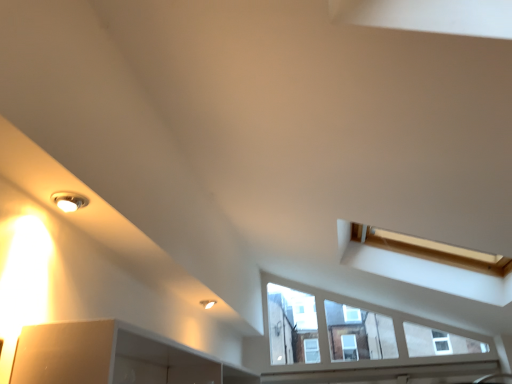
Question: From a real-world perspective, is matte white light fixture at upper left, which ranks as the 1th light fixture in right-to-left order, above or below white painted wood at lower center?

Choices:
 (A) below
 (B) above

Answer: (B)

Question: Is matte white light fixture at upper left, the first light fixture ordered from the bottom, in front of or behind white painted wood at lower center in the image?

Choices:
 (A) front
 (B) behind

Answer: (A)

Question: Considering the real-world distances, which object is closest to the matte white light fixture at upper left, placed as the 2th light fixture when sorted from top to bottom?

Choices:
 (A) white painted wood at lower center
 (B) matte silver light fixture at upper left, the second light fixture when ordered from bottom to top

Answer: (B)

Question: Which of these objects is positioned farthest from the matte white light fixture at upper left, the first light fixture ordered from the bottom?

Choices:
 (A) white painted wood at lower center
 (B) matte silver light fixture at upper left, arranged as the 2th light fixture when viewed from the right

Answer: (A)